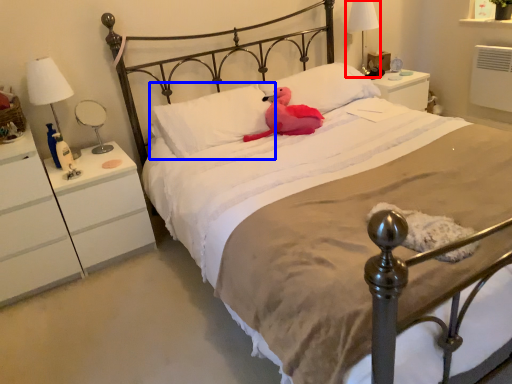
Question: Which of the following is the closest to the observer, bedside lamp (highlighted by a red box) or pillow (highlighted by a blue box)?

Choices:
 (A) bedside lamp
 (B) pillow

Answer: (B)